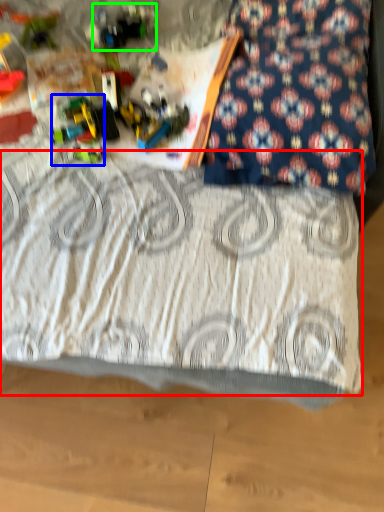
Question: Estimate the real-world distances between objects in this image. Which object is closer to bedding (highlighted by a red box), toy (highlighted by a blue box) or toy (highlighted by a green box)?

Choices:
 (A) toy
 (B) toy

Answer: (A)